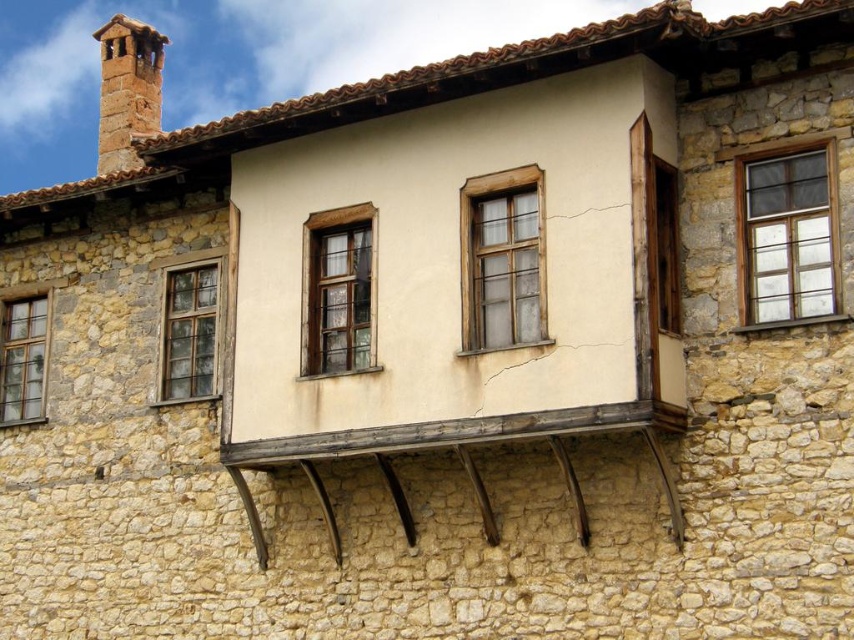
The width and height of the screenshot is (854, 640). What do you see at coordinates (787, 234) in the screenshot?
I see `clear glass window at upper right` at bounding box center [787, 234].

Between clear glass window at upper right and translucent glass window at center, which one has more height?

translucent glass window at center is taller.

Locate an element on the screen. The image size is (854, 640). clear glass window at upper right is located at coordinates (787, 234).

Does point (536, 336) lie behind point (30, 371)?

That is False.

Is point (530, 296) less distant than point (39, 369)?

Yes, point (530, 296) is closer to viewer.

Locate an element on the screen. translucent glass window at center is located at coordinates (502, 259).

Measure the distance from translucent glass window at center to rustic stone chimney at upper left.

translucent glass window at center and rustic stone chimney at upper left are 100.40 feet apart from each other.

Which is above, translucent glass window at center or rustic stone chimney at upper left?

rustic stone chimney at upper left is higher up.

Locate an element on the screen. This screenshot has height=640, width=854. translucent glass window at center is located at coordinates (502, 259).